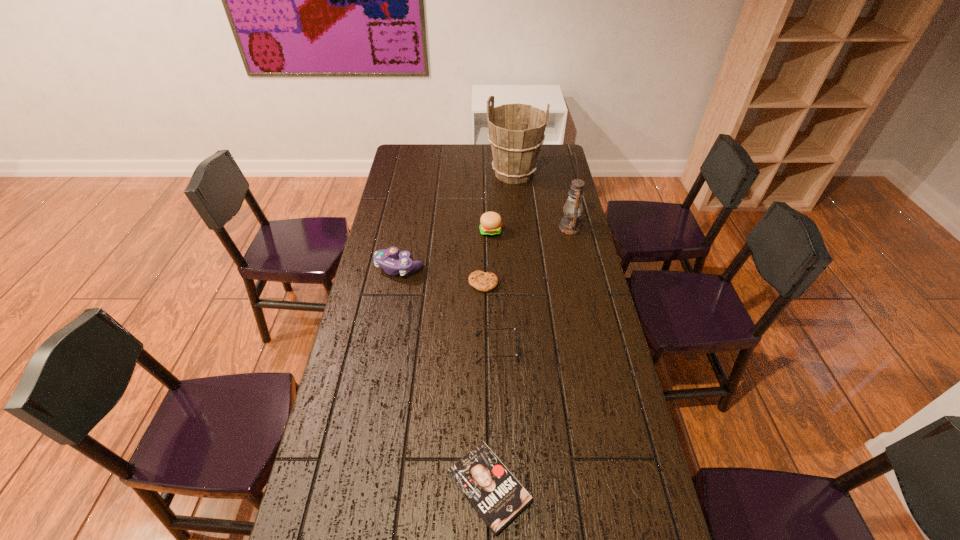
At what (x,y) coordinates should I click in order to perform the action: click on blank space located 0.080m on the left of the hamburger. Please return your answer as a coordinate pair (x, y). This screenshot has height=540, width=960. Looking at the image, I should click on (460, 232).

Where is `free region located on the front of the control`? The image size is (960, 540). free region located on the front of the control is located at coordinates (383, 360).

Find the location of a particular element. This screenshot has height=540, width=960. vacant space located 0.280m with the lenses facing outward on the third shortest object is located at coordinates (388, 349).

I want to click on free space located with the lenses facing outward on the third shortest object, so pos(425,349).

Image resolution: width=960 pixels, height=540 pixels. Identify the location of free space located 0.230m with the lenses facing outward on the third shortest object. (403, 349).

You are a GUI agent. You are given a task and a screenshot of the screen. Output one action in this format:
    pyautogui.click(x=<x>, y=<y>)
    Task: Click on the blank area located 0.370m on the back of the cookie
    This screenshot has width=960, height=540.
    Given the screenshot: What is the action you would take?
    pyautogui.click(x=483, y=214)

Locate an element on the screen. This screenshot has width=960, height=540. free space located on the right of the book is located at coordinates (566, 488).

This screenshot has height=540, width=960. Identify the location of object that is at the far edge. (516, 131).

Where is `object that is at the left edge`? This screenshot has width=960, height=540. object that is at the left edge is located at coordinates 385,258.

The image size is (960, 540). What are the coordinates of `bucket present at the right edge` in the screenshot? It's located at (516, 131).